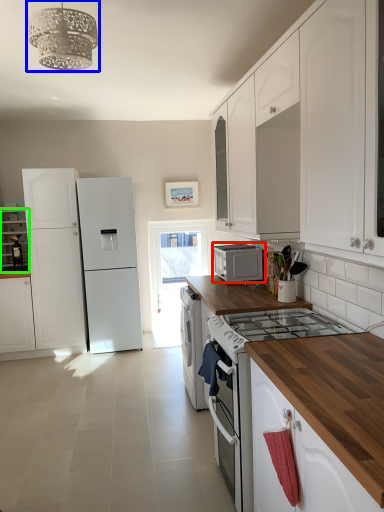
Question: Estimate the real-world distances between objects in this image. Which object is farther from microwave oven (highlighted by a red box), light fixture (highlighted by a blue box) or cabinetry (highlighted by a green box)?

Choices:
 (A) light fixture
 (B) cabinetry

Answer: (B)